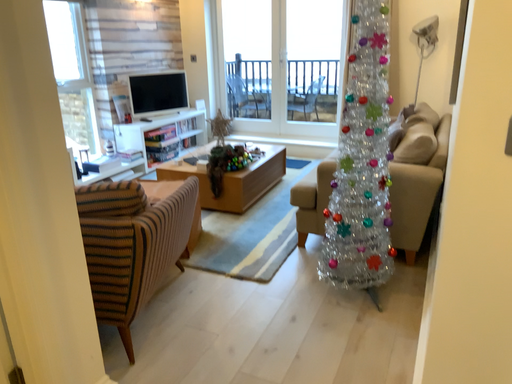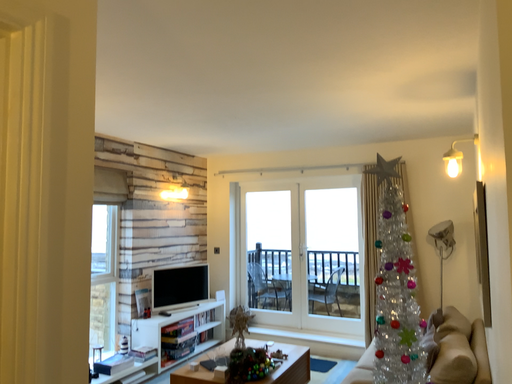
Question: Which way did the camera rotate in the video?

Choices:
 (A) rotated downward
 (B) rotated upward

Answer: (B)